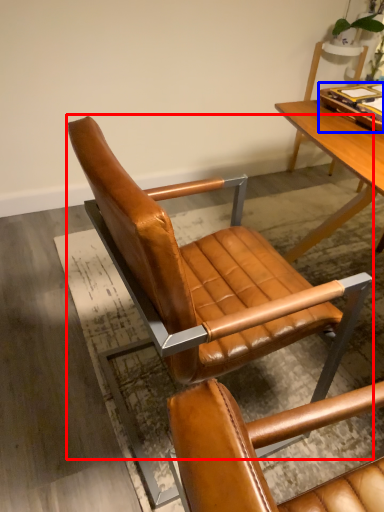
Question: Which point is closer to the camera, chair (highlighted by a red box) or tray (highlighted by a blue box)?

Choices:
 (A) chair
 (B) tray

Answer: (A)